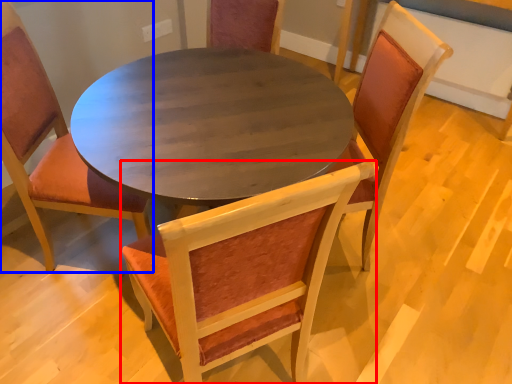
Question: Which object is closer to the camera taking this photo, chair (highlighted by a red box) or chair (highlighted by a blue box)?

Choices:
 (A) chair
 (B) chair

Answer: (A)